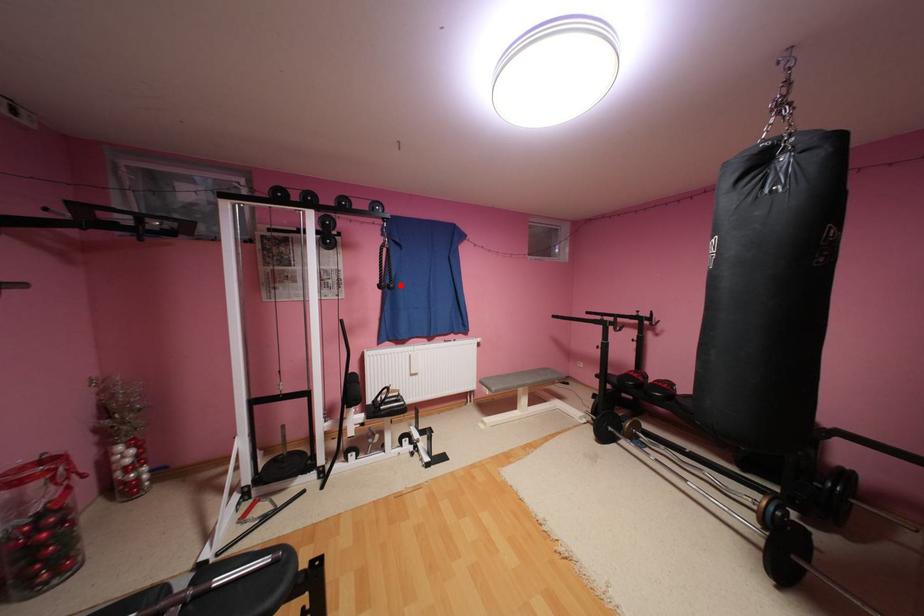
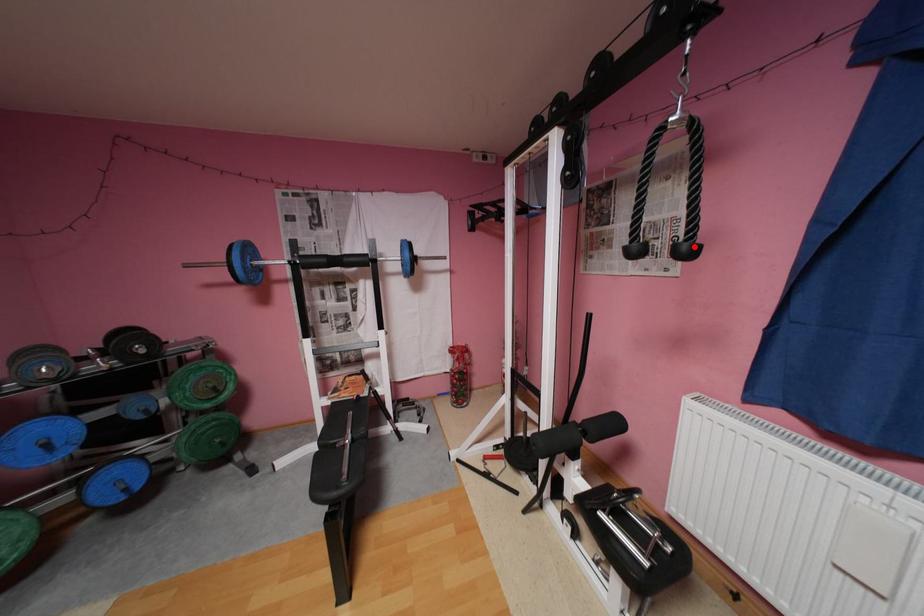
I am providing you with two images of the same scene from different viewpoints. A red point is marked on the first image and another point is marked on the second image. Is the marked point in image1 the same physical position as the marked point in image2?

→ Yes